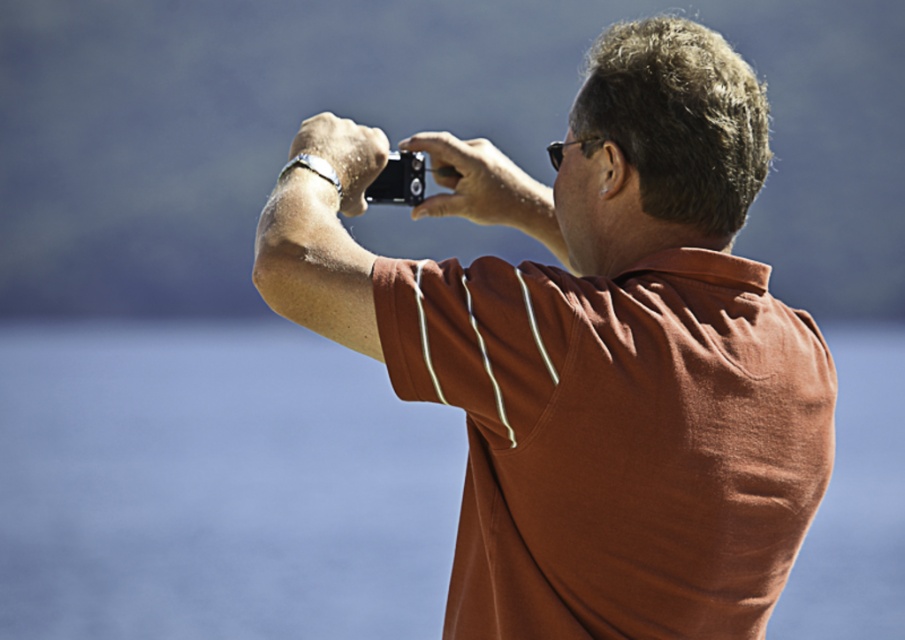
You are a photographer standing at the edge of a lake, holding a camera. You want to capture a clear image of the transparent blue water at center. Based on the scene description, what is the minimum focal length you should use to ensure the water fills the frame?

To capture the transparent blue water at center clearly, the minimum focal length required is determined by the distance of 21.71 meters. However, without knowing the sensor size of the camera, an exact focal length cannot be calculated. A longer focal length would help compress the perspective and fill the frame with the water.

You are a photographer trying to capture the transparent blue water at center. Based on the scene description, where should you position your camera to ensure the water is in the center of your photo?

The transparent blue water at center is located at point (216, 486), so position your camera to aim directly at those coordinates to center the water in your photo.

You are a photographer trying to capture the transparent blue water at center in your frame. You notice the matte black camera at center is blocking your view. Can you move the camera to the left to get a clearer shot of the water?

The matte black camera at center is to the right of the transparent blue water at center, so moving it to the left would allow you to see the transparent blue water at center more clearly.